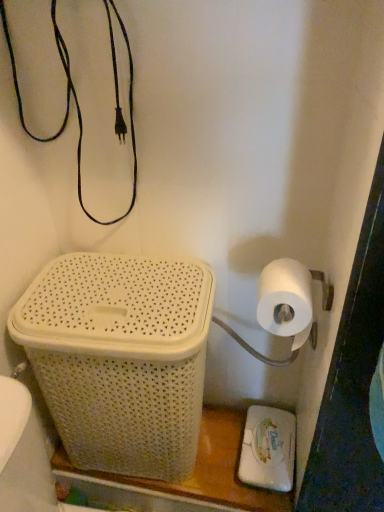
Image resolution: width=384 pixels, height=512 pixels. I want to click on vacant region above white wicker basket at lower left (from a real-world perspective), so click(x=99, y=298).